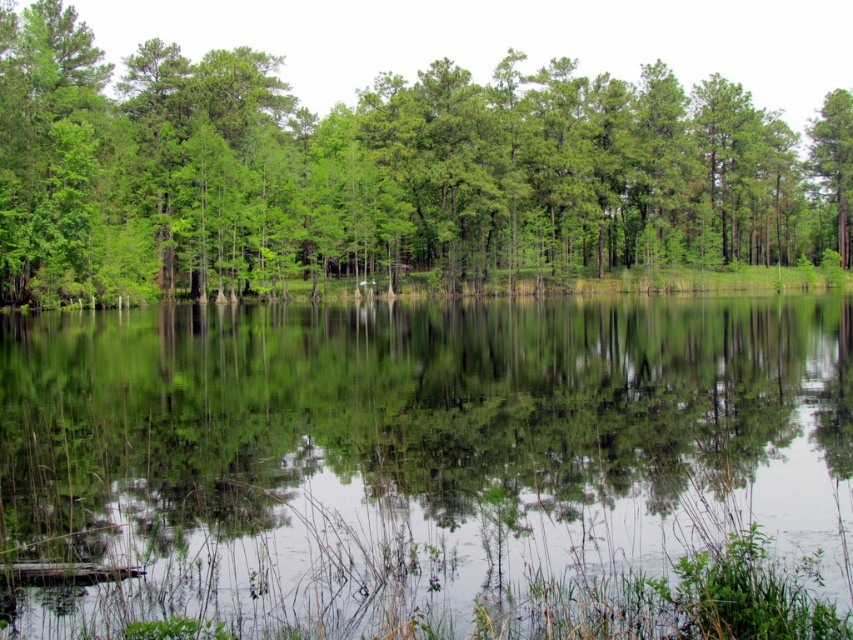
How much distance is there between clear water at center and green leafy tree at center?

clear water at center is 39.96 meters away from green leafy tree at center.

Can you confirm if clear water at center is bigger than green leafy tree at center?

Incorrect, clear water at center is not larger than green leafy tree at center.

Where is `clear water at center`? This screenshot has width=853, height=640. clear water at center is located at coordinates (408, 451).

You are a GUI agent. You are given a task and a screenshot of the screen. Output one action in this format:
    pyautogui.click(x=<x>, y=<y>)
    Task: Click on the clear water at center
    The width and height of the screenshot is (853, 640).
    Given the screenshot: What is the action you would take?
    pyautogui.click(x=408, y=451)